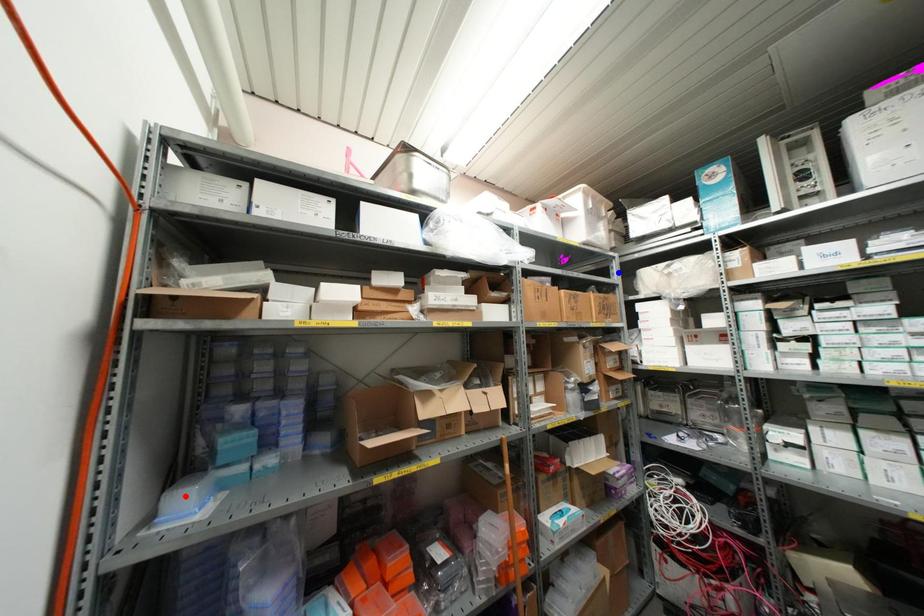
Question: Which of the two points in the image is closer to the camera?

Choices:
 (A) Blue point is closer.
 (B) Red point is closer.

Answer: (B)